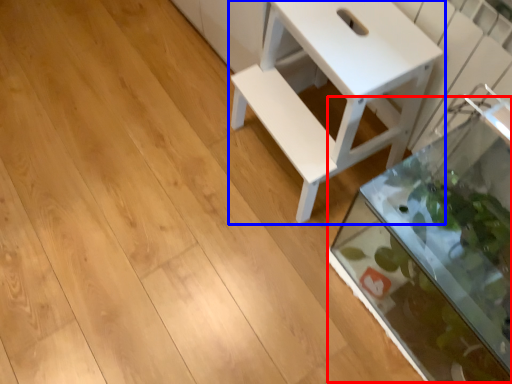
Question: Which object appears closest to the camera in this image, glass box (highlighted by a red box) or table (highlighted by a blue box)?

Choices:
 (A) glass box
 (B) table

Answer: (A)